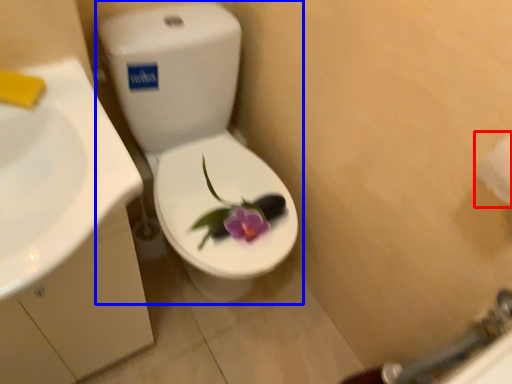
Question: Which of the following is the farthest to the observer, toilet paper (highlighted by a red box) or toilet (highlighted by a blue box)?

Choices:
 (A) toilet paper
 (B) toilet

Answer: (B)